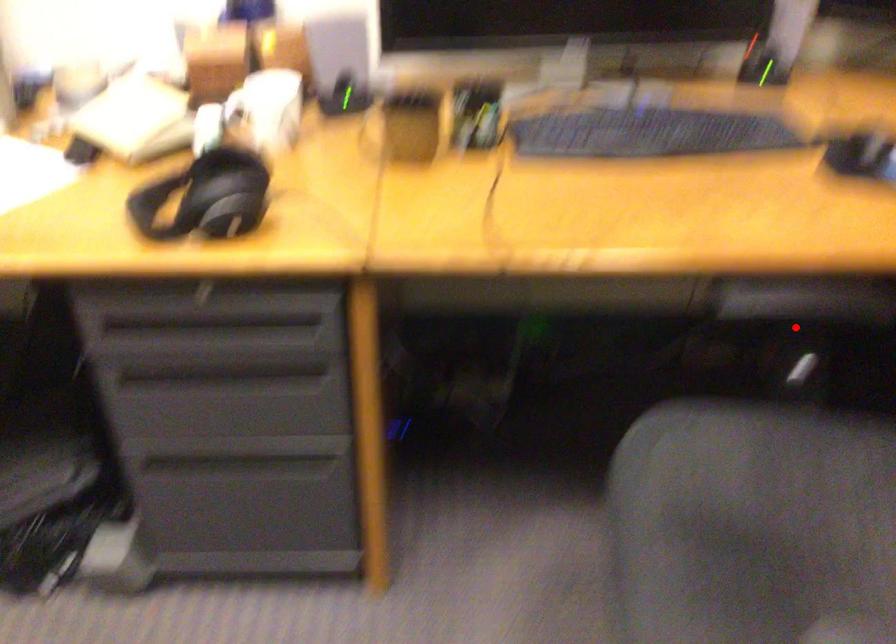
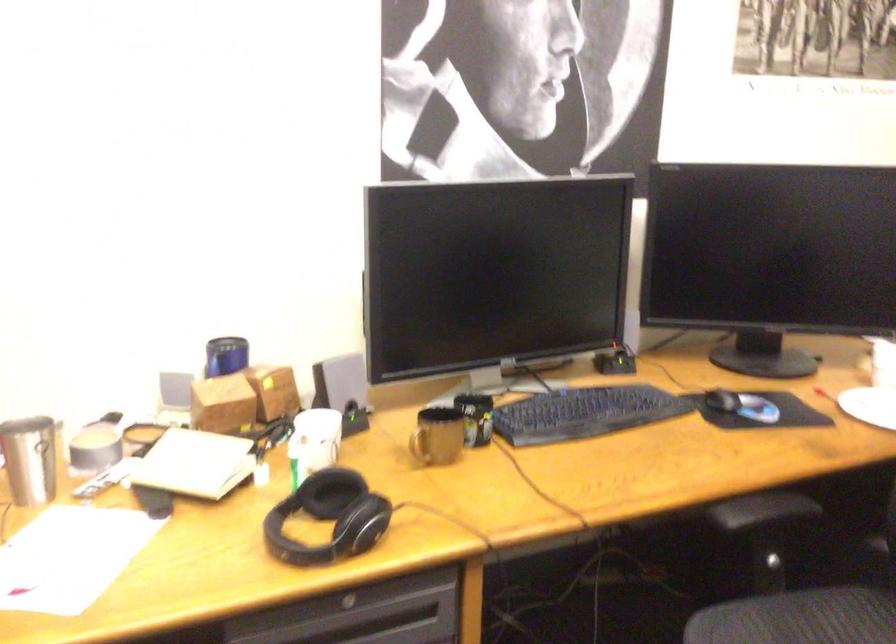
Question: I am providing you with two images of the same scene from different viewpoints. Image1 has a red point marked. In image2, the corresponding 3D location appears at what relative position? Reply with the corresponding letter.

Choices:
 (A) Closer
 (B) Farther

Answer: (B)